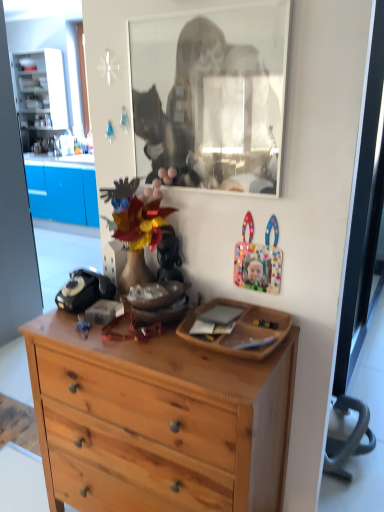
Question: Are natural wood dresser at center and black glass mirror at upper center far apart?

Choices:
 (A) no
 (B) yes

Answer: (A)

Question: Is natural wood dresser at center at the left side of black glass mirror at upper center?

Choices:
 (A) no
 (B) yes

Answer: (B)

Question: Does natural wood dresser at center come behind black glass mirror at upper center?

Choices:
 (A) no
 (B) yes

Answer: (A)

Question: Is the depth of natural wood dresser at center less than that of black glass mirror at upper center?

Choices:
 (A) yes
 (B) no

Answer: (A)

Question: From the image's perspective, is natural wood dresser at center under black glass mirror at upper center?

Choices:
 (A) no
 (B) yes

Answer: (B)

Question: Is matte plastic mask at center wider or thinner than natural wood dresser at center?

Choices:
 (A) thin
 (B) wide

Answer: (A)

Question: Is matte plastic mask at center in front of or behind natural wood dresser at center in the image?

Choices:
 (A) front
 (B) behind

Answer: (B)

Question: Choose the correct answer: Is matte plastic mask at center inside natural wood dresser at center or outside it?

Choices:
 (A) outside
 (B) inside

Answer: (A)

Question: In terms of height, does matte plastic mask at center look taller or shorter compared to natural wood dresser at center?

Choices:
 (A) tall
 (B) short

Answer: (B)

Question: Considering the positions of natural wood dresser at center and black glass mirror at upper center in the image, is natural wood dresser at center bigger or smaller than black glass mirror at upper center?

Choices:
 (A) small
 (B) big

Answer: (B)

Question: Relative to black glass mirror at upper center, is natural wood dresser at center in front or behind?

Choices:
 (A) behind
 (B) front

Answer: (B)

Question: From a real-world perspective, relative to black glass mirror at upper center, is natural wood dresser at center vertically above or below?

Choices:
 (A) above
 (B) below

Answer: (B)

Question: Is natural wood dresser at center to the left or to the right of black glass mirror at upper center in the image?

Choices:
 (A) left
 (B) right

Answer: (A)

Question: In terms of size, does matte plastic mask at center appear bigger or smaller than black glass mirror at upper center?

Choices:
 (A) big
 (B) small

Answer: (B)

Question: Looking at their shapes, would you say matte plastic mask at center is wider or thinner than black glass mirror at upper center?

Choices:
 (A) wide
 (B) thin

Answer: (A)